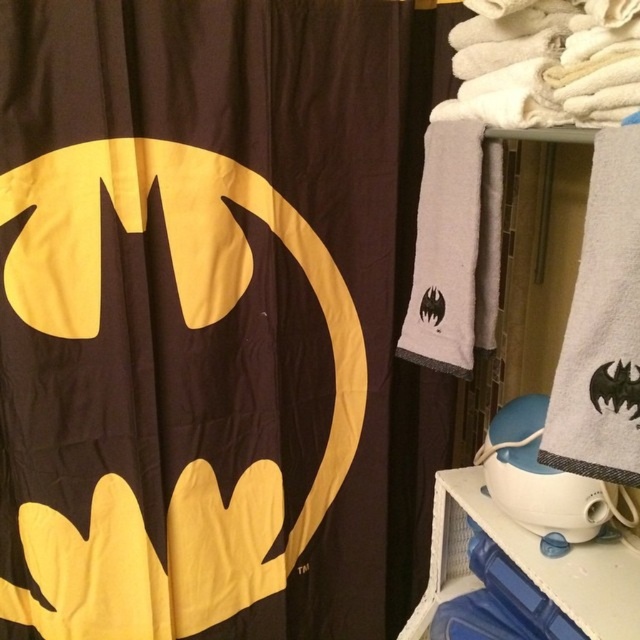
Does matte black fabric batman logo at left have a greater height compared to white plastic shelf at lower right?

Yes, matte black fabric batman logo at left is taller than white plastic shelf at lower right.

Between matte black fabric batman logo at left and white plastic shelf at lower right, which one appears on the right side from the viewer's perspective?

From the viewer's perspective, white plastic shelf at lower right appears more on the right side.

At what (x,y) coordinates should I click in order to perform the action: click on matte black fabric batman logo at left. Please return your answer as a coordinate pair (x, y). The image size is (640, 640). Looking at the image, I should click on (195, 316).